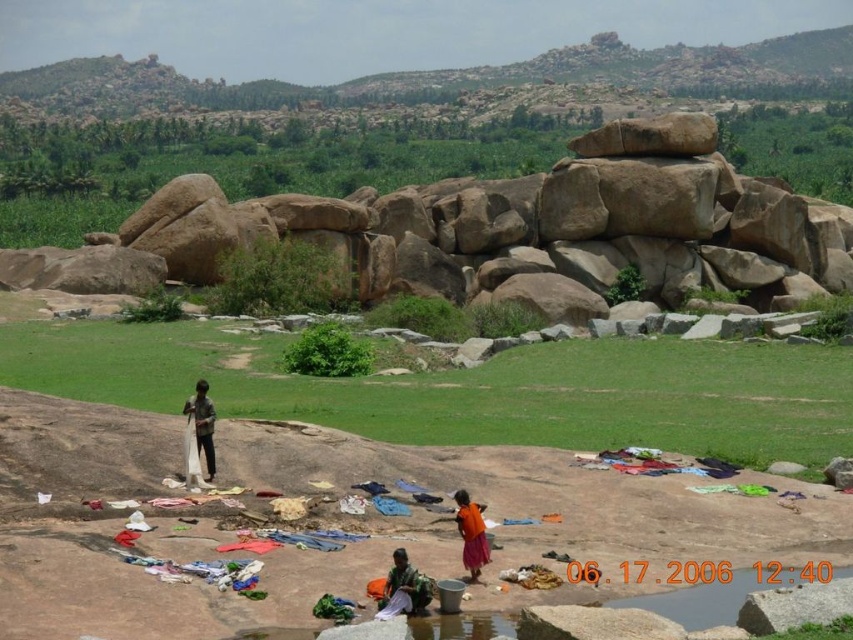
Is white cotton cloth at lower center smaller than orange cotton dress at center?

Incorrect, white cotton cloth at lower center is not smaller in size than orange cotton dress at center.

Does white cotton cloth at lower center have a lesser width compared to orange cotton dress at center?

No, white cotton cloth at lower center is not thinner than orange cotton dress at center.

Between point (399, 602) and point (477, 513), which one is positioned in front?

Point (399, 602)

Find the location of a particular element. Image resolution: width=853 pixels, height=640 pixels. white cotton cloth at lower center is located at coordinates (404, 588).

Which is behind, point (393, 595) or point (206, 420)?

Point (206, 420)

Which is more to the left, white cotton cloth at lower center or dark brown fabric at center?

dark brown fabric at center is more to the left.

Identify the location of white cotton cloth at lower center. The width and height of the screenshot is (853, 640). (404, 588).

What are the coordinates of `white cotton cloth at lower center` in the screenshot? It's located at (404, 588).

Who is lower down, dark brown fabric at center or orange cotton dress at center?

Positioned lower is orange cotton dress at center.

The image size is (853, 640). Describe the element at coordinates (202, 422) in the screenshot. I see `dark brown fabric at center` at that location.

Where is `dark brown fabric at center`? The image size is (853, 640). dark brown fabric at center is located at coordinates (202, 422).